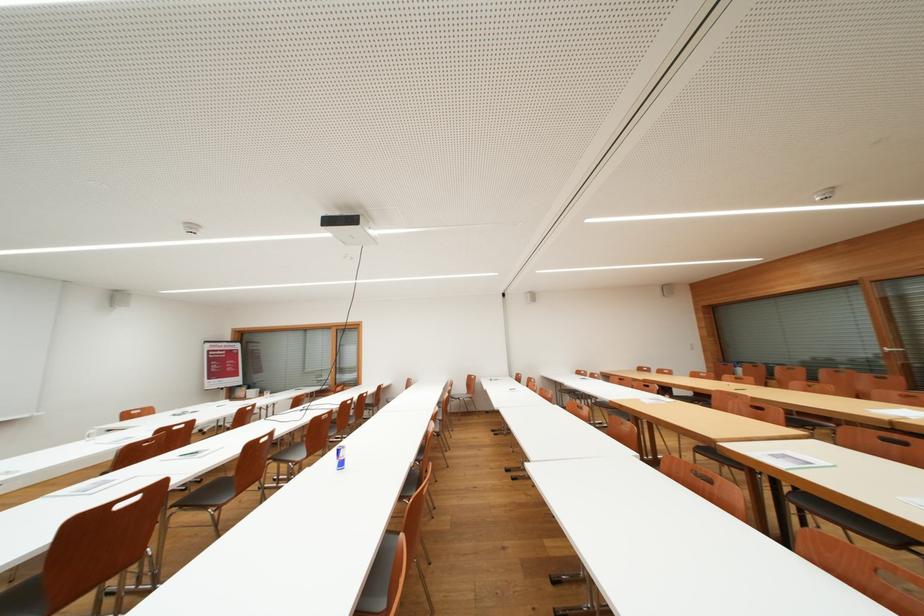
Locate an element on the screen. This screenshot has height=616, width=924. blue beverage can is located at coordinates (339, 456).